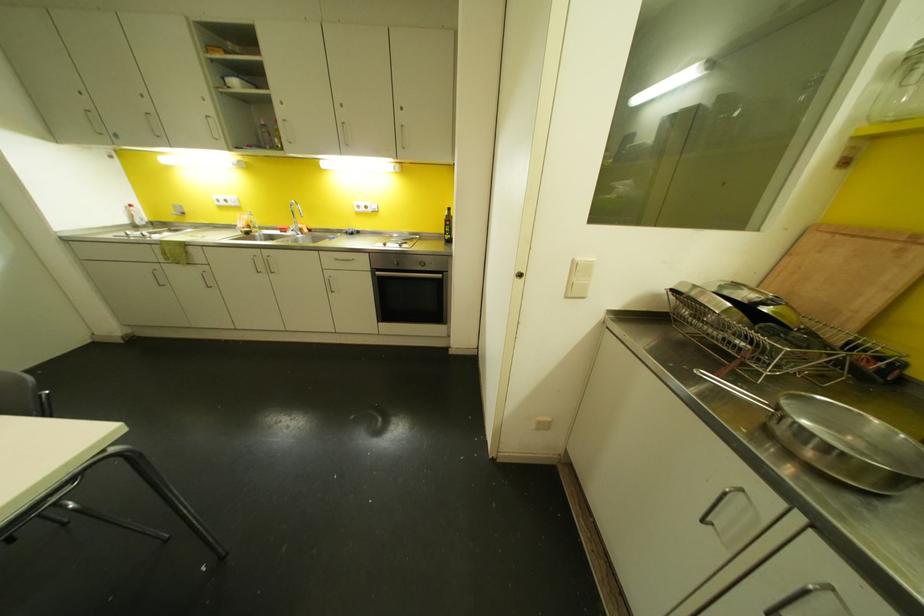
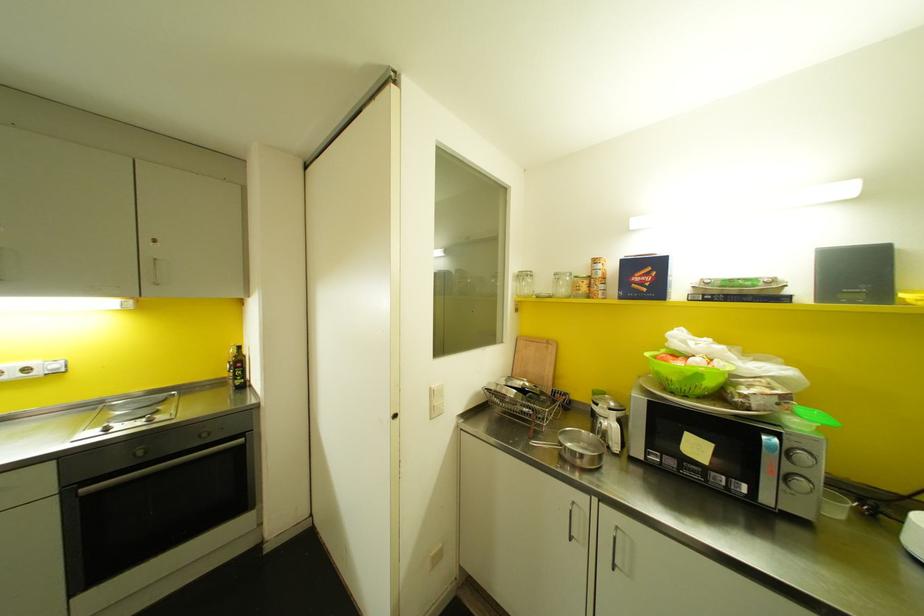
Locate, in the second image, the point that corresponds to (x=399, y=245) in the first image.

(150, 419)